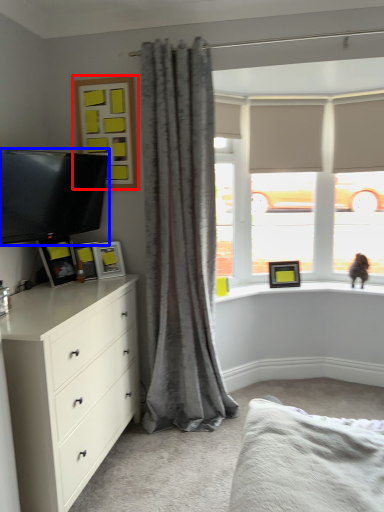
Question: Which object is further to the camera taking this photo, picture frame (highlighted by a red box) or television (highlighted by a blue box)?

Choices:
 (A) picture frame
 (B) television

Answer: (A)